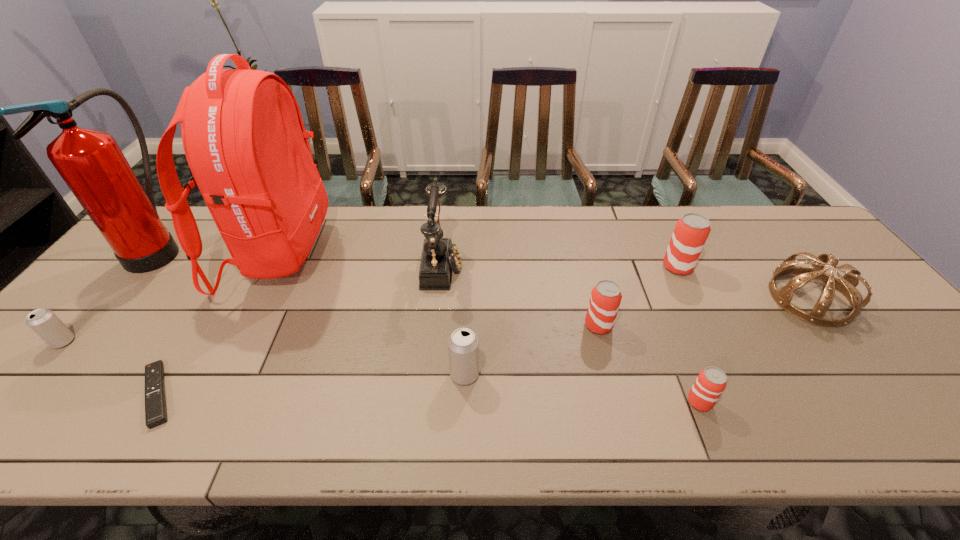
Locate an element on the screen. This screenshot has height=540, width=960. beer can present at the near edge is located at coordinates (711, 382).

Find the location of a particular element. This screenshot has width=960, height=540. remote control that is positioned at the near edge is located at coordinates (155, 403).

Where is `fire extinguisher at the left edge`? The height and width of the screenshot is (540, 960). fire extinguisher at the left edge is located at coordinates (91, 163).

Locate an element on the screen. This screenshot has height=540, width=960. beer can that is at the left edge is located at coordinates (44, 322).

Where is `object present at the right edge`? This screenshot has width=960, height=540. object present at the right edge is located at coordinates (846, 285).

At what (x,y) coordinates should I click in order to perform the action: click on object that is at the far left corner. Please return your answer as a coordinate pair (x, y). This screenshot has height=540, width=960. Looking at the image, I should click on (91, 163).

In the image, there is a desktop. Where is `free space at the far edge`? free space at the far edge is located at coordinates [488, 210].

Image resolution: width=960 pixels, height=540 pixels. I want to click on vacant space at the near edge of the desktop, so click(x=265, y=426).

The width and height of the screenshot is (960, 540). What are the coordinates of `blank space at the right edge of the desktop` in the screenshot? It's located at tap(870, 331).

Find the location of a particular element. vacant space at the far right corner of the desktop is located at coordinates (780, 219).